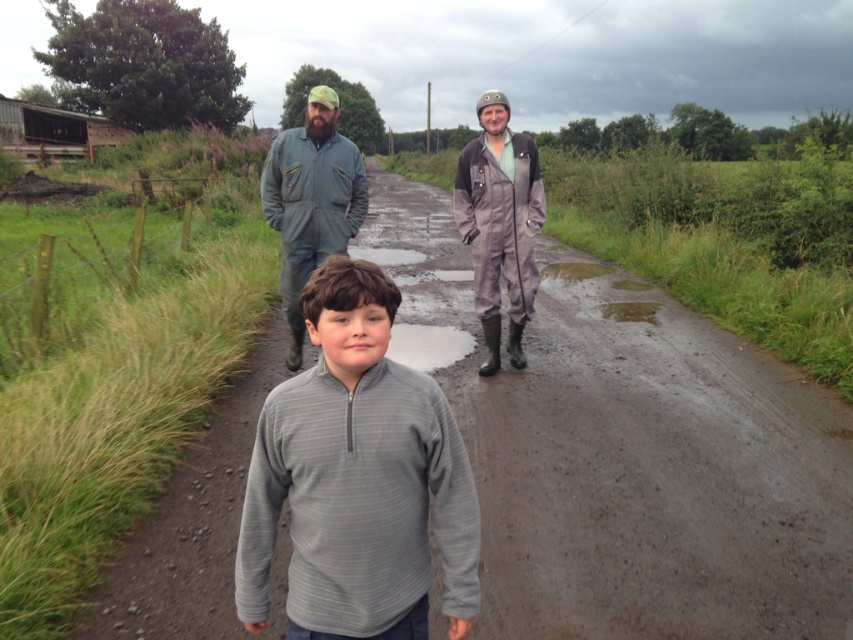
Question: Does gray asphalt road at center have a greater width compared to gray fleece at center?

Choices:
 (A) no
 (B) yes

Answer: (B)

Question: Does gray fleece at center appear over green fabric jumpsuit at center?

Choices:
 (A) yes
 (B) no

Answer: (B)

Question: Based on their relative distances, which object is farther from the green fabric jumpsuit at center?

Choices:
 (A) white matte puddle at center
 (B) gray matte coveralls at center

Answer: (B)

Question: Is green fabric jumpsuit at center behind white matte puddle at center?

Choices:
 (A) yes
 (B) no

Answer: (B)

Question: Among these objects, which one is nearest to the camera?

Choices:
 (A) white matte puddle at center
 (B) gray asphalt road at center
 (C) green fabric jumpsuit at center

Answer: (B)

Question: Based on their relative distances, which object is nearer to the gray fleece at center?

Choices:
 (A) green fabric jumpsuit at center
 (B) gray asphalt road at center
 (C) white matte puddle at center
 (D) gray matte coveralls at center

Answer: (B)